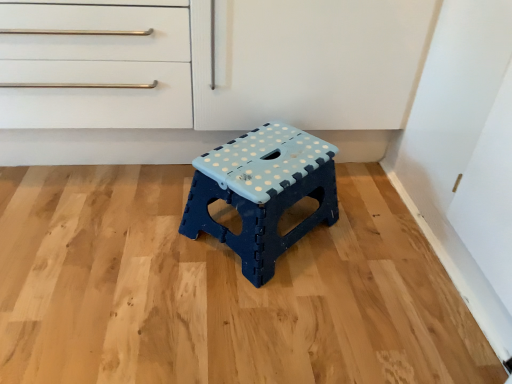
The height and width of the screenshot is (384, 512). Describe the element at coordinates (220, 289) in the screenshot. I see `light brown wood at center` at that location.

Identify the location of light brown wood at center. (220, 289).

What do you see at coordinates (262, 192) in the screenshot? The height and width of the screenshot is (384, 512). I see `blue plastic stool at center` at bounding box center [262, 192].

Identify the location of blue plastic stool at center. The image size is (512, 384). (262, 192).

What is the approximate width of blue plastic stool at center?

blue plastic stool at center is 13.68 inches wide.

Image resolution: width=512 pixels, height=384 pixels. Find the location of `light brown wood at center`. light brown wood at center is located at coordinates (220, 289).

From the picture: Would you say light brown wood at center is to the left or to the right of blue plastic stool at center in the picture?

Clearly, light brown wood at center is on the left of blue plastic stool at center in the image.

Considering the relative positions of light brown wood at center and blue plastic stool at center in the image provided, is light brown wood at center behind blue plastic stool at center?

No, it is in front of blue plastic stool at center.

Is point (117, 219) in front of point (256, 166)?

No, it is behind (256, 166).

From the image's perspective, between light brown wood at center and blue plastic stool at center, which one is located above?

blue plastic stool at center, from the image's perspective.

From a real-world perspective, between light brown wood at center and blue plastic stool at center, who is vertically lower?

light brown wood at center.

Which of these two, light brown wood at center or blue plastic stool at center, is wider?

light brown wood at center is wider.

Which of these two, light brown wood at center or blue plastic stool at center, stands shorter?

light brown wood at center is shorter.

Does light brown wood at center have a smaller size compared to blue plastic stool at center?

No.

Is light brown wood at center inside the boundaries of blue plastic stool at center, or outside?

light brown wood at center is outside blue plastic stool at center.

Is light brown wood at center directly adjacent to blue plastic stool at center?

No, light brown wood at center is not next to blue plastic stool at center.

Is light brown wood at center turned away from blue plastic stool at center?

No, light brown wood at center's orientation is not away from blue plastic stool at center.

At what (x,y) coordinates should I click in order to perform the action: click on stool behind the light brown wood at center. Please return your answer as a coordinate pair (x, y). Looking at the image, I should click on (262, 192).

Is blue plastic stool at center at the right side of light brown wood at center?

Yes, blue plastic stool at center is to the right of light brown wood at center.

Which is behind, blue plastic stool at center or light brown wood at center?

Positioned behind is blue plastic stool at center.

Is point (311, 215) less distant than point (138, 357)?

No, (311, 215) is further to viewer.

From the image's perspective, is blue plastic stool at center above light brown wood at center?

Yes, from the image's perspective, blue plastic stool at center is above light brown wood at center.

From a real-world perspective, who is located higher, blue plastic stool at center or light brown wood at center?

blue plastic stool at center is physically above.

Is blue plastic stool at center wider than light brown wood at center?

No, blue plastic stool at center is not wider than light brown wood at center.

Who is taller, blue plastic stool at center or light brown wood at center?

Standing taller between the two is blue plastic stool at center.

Who is smaller, blue plastic stool at center or light brown wood at center?

Smaller between the two is blue plastic stool at center.

Consider the image. Can we say blue plastic stool at center lies outside light brown wood at center?

Yes, blue plastic stool at center is outside of light brown wood at center.

Would you say blue plastic stool at center is a long distance from light brown wood at center?

They are positioned close to each other.

Is blue plastic stool at center facing away from light brown wood at center?

No, light brown wood at center is not at the back of blue plastic stool at center.

I want to click on hardwood below the blue plastic stool at center (from a real-world perspective), so click(x=220, y=289).

Where is `hardwood on the left side of blue plastic stool at center`? Image resolution: width=512 pixels, height=384 pixels. hardwood on the left side of blue plastic stool at center is located at coordinates (220, 289).

I want to click on stool that is above the light brown wood at center (from a real-world perspective), so click(x=262, y=192).